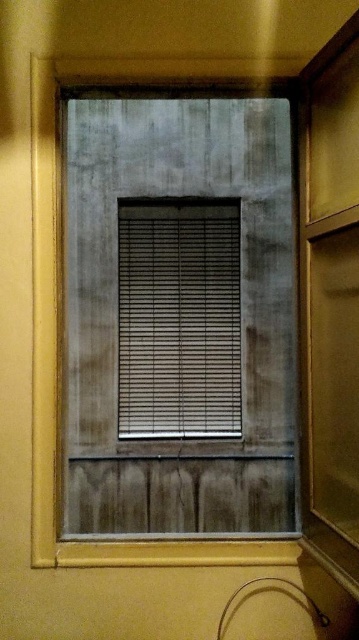
Can you confirm if matte gray window at center is positioned to the left of matte gray blinds at center?

No, matte gray window at center is not to the left of matte gray blinds at center.

Which is more to the left, matte gray window at center or matte gray blinds at center?

matte gray blinds at center

Does point (257, 275) lie in front of point (138, 305)?

No, it is not.

Where is `matte gray window at center`? The width and height of the screenshot is (359, 640). matte gray window at center is located at coordinates (179, 314).